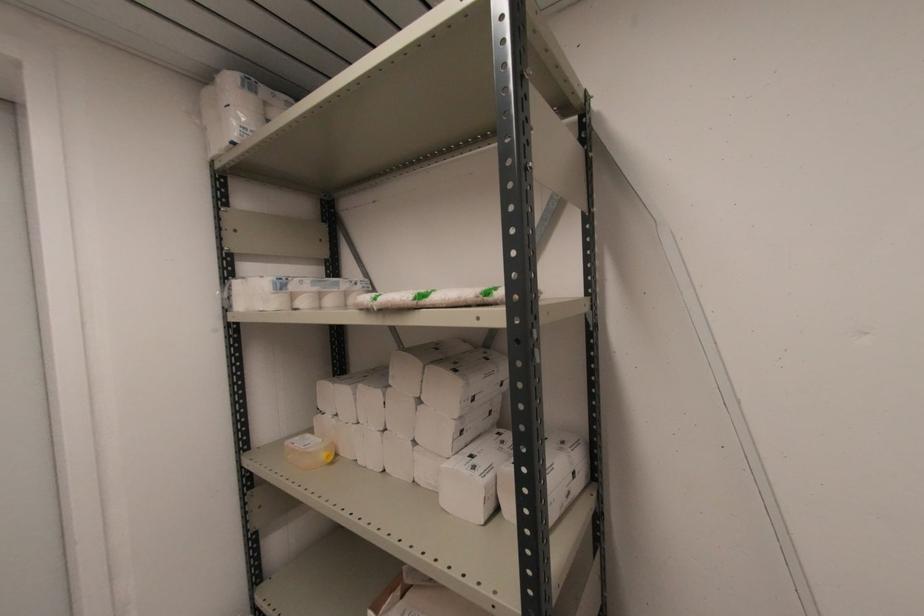
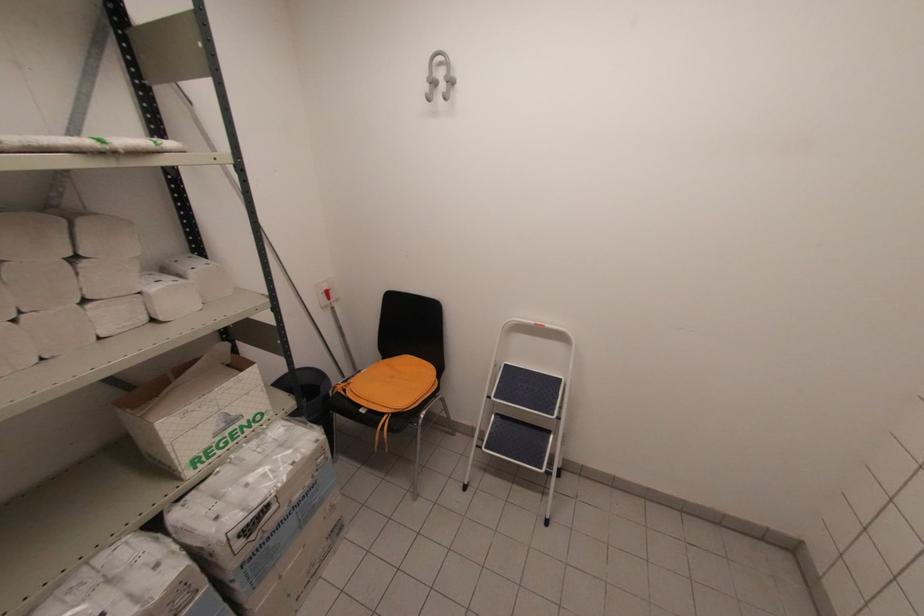
Locate, in the second image, the point that corresponds to the point at 371,305 in the first image.

(107, 148)